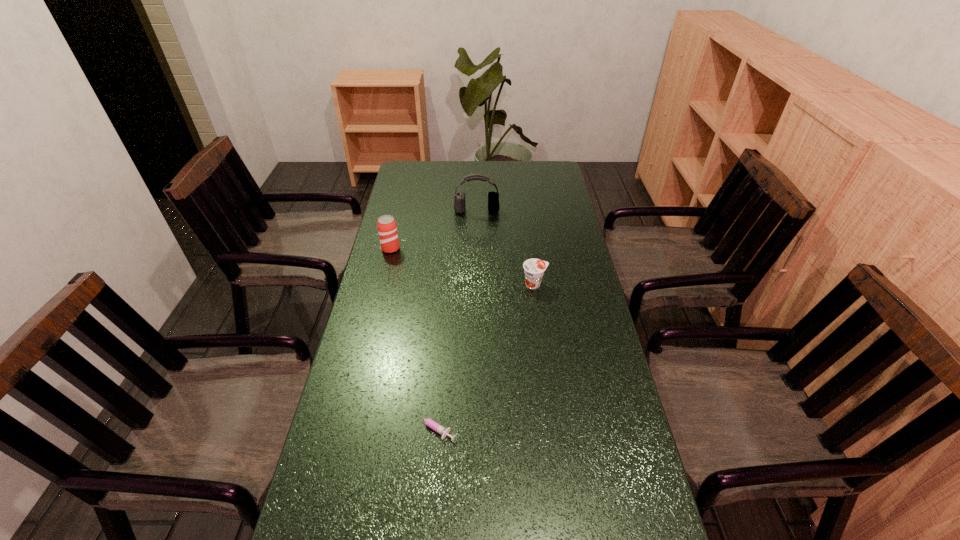
Where is `vacant space located on the left of the yogurt`? This screenshot has height=540, width=960. vacant space located on the left of the yogurt is located at coordinates (479, 284).

Where is `vacant space situated 0.360m on the right of the shortest object`? vacant space situated 0.360m on the right of the shortest object is located at coordinates (603, 427).

Where is `object present at the left edge`? This screenshot has width=960, height=540. object present at the left edge is located at coordinates (387, 229).

What are the coordinates of `object that is at the right edge` in the screenshot? It's located at (534, 269).

The image size is (960, 540). I want to click on free space at the far edge, so click(524, 174).

In the image, there is a desktop. Identify the location of vacant space at the left edge. This screenshot has height=540, width=960. (380, 345).

Identify the location of blank space at the right edge. The image size is (960, 540). (540, 218).

This screenshot has height=540, width=960. Find the location of `vacant area between the leftmost object and the tallest object`. vacant area between the leftmost object and the tallest object is located at coordinates (434, 230).

This screenshot has height=540, width=960. Identify the location of vacant area that lies between the yogurt and the second farthest object. (463, 266).

This screenshot has width=960, height=540. Identify the location of unoccupied position between the tallest object and the beer can. (434, 230).